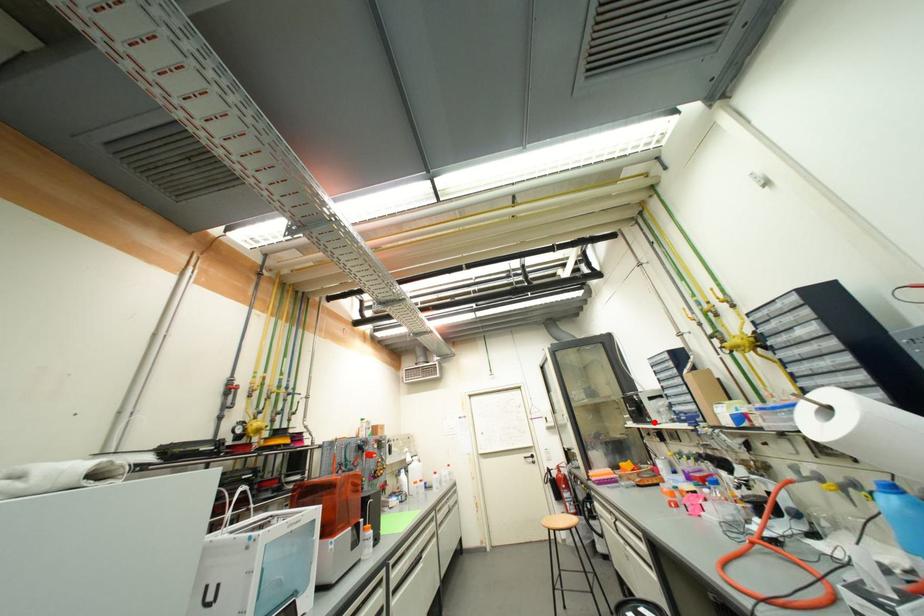
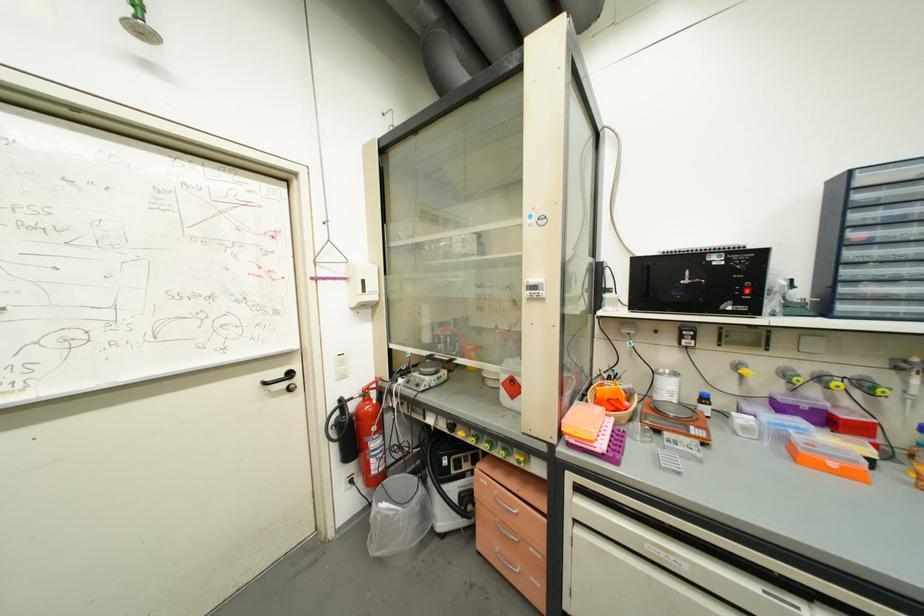
Question: I am providing you with two images of the same scene from different viewpoints. A red point is marked on the first image. At the location where the point appears in image 1, is it still visible in image 2?

Choices:
 (A) Yes
 (B) No

Answer: (A)